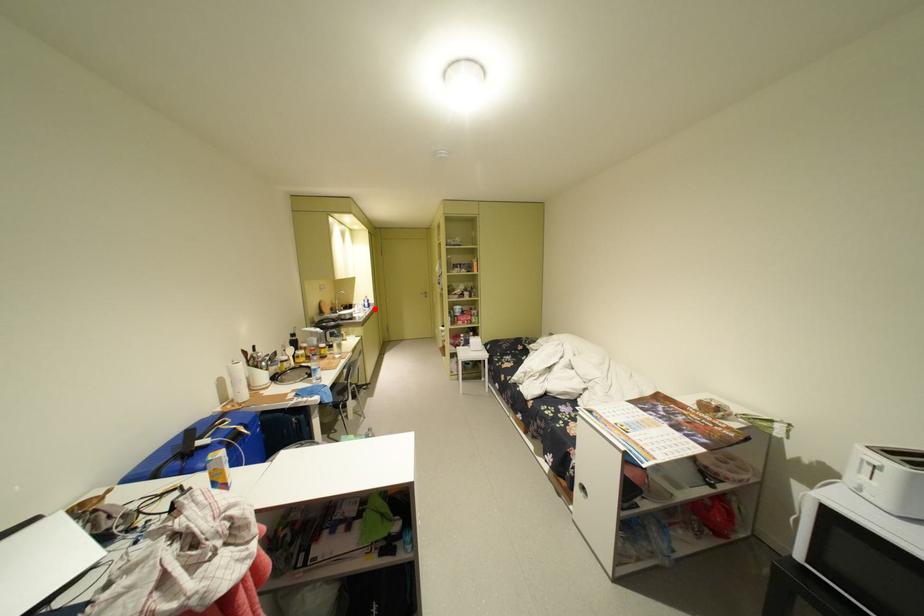
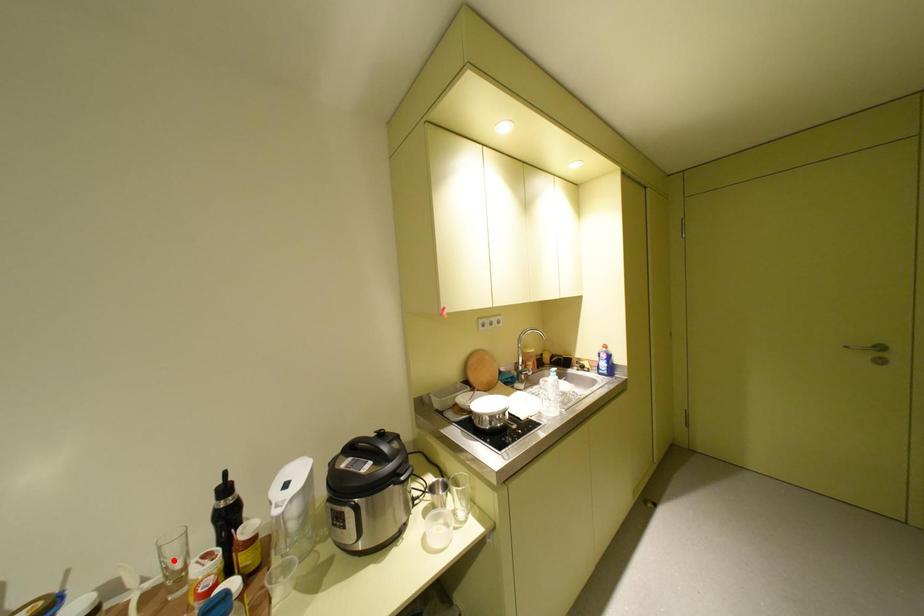
I am providing you with two images of the same scene from different viewpoints. A red point is marked on the first image and another point is marked on the second image. Do the highlighted points in image1 and image2 indicate the same real-world spot?

No